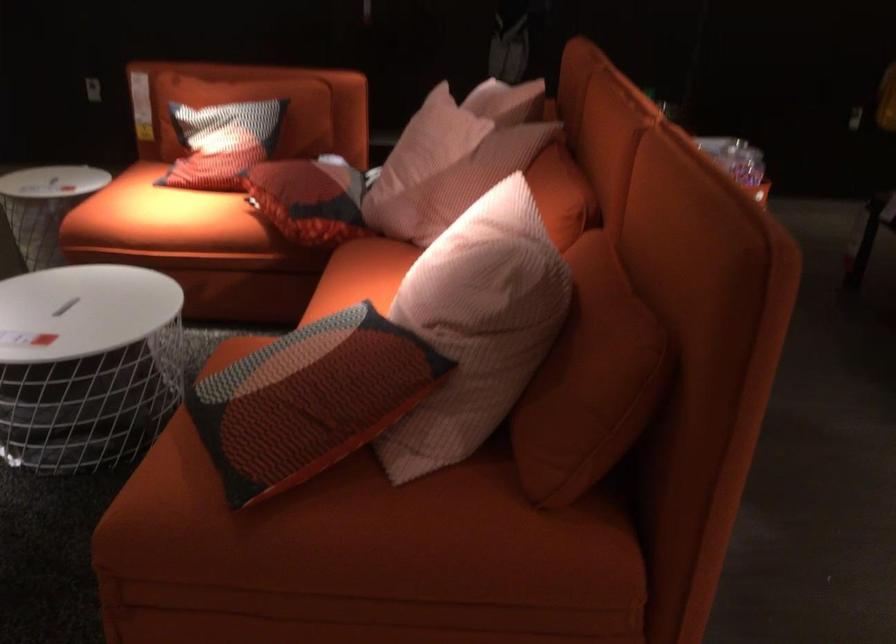
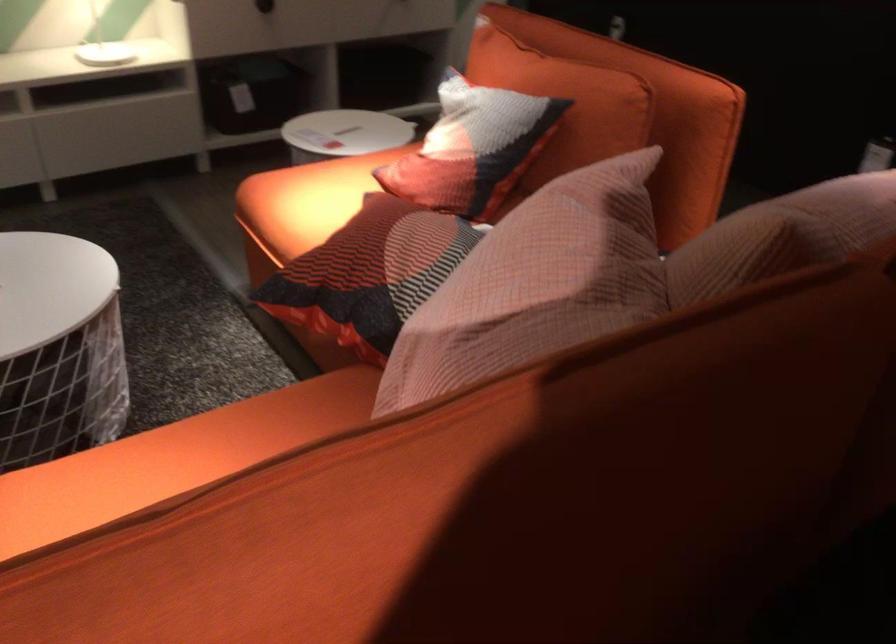
Locate, in the second image, the point that corresponds to the point at 139,212 in the first image.

(306, 200)